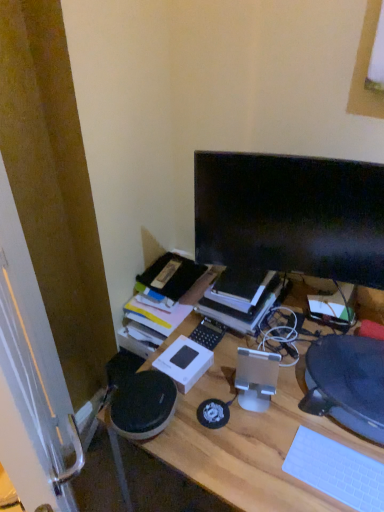
Question: Is white matte keyboard at lower right outside black textured computer chair at right?

Choices:
 (A) no
 (B) yes

Answer: (B)

Question: Does white matte keyboard at lower right lie behind black textured computer chair at right?

Choices:
 (A) no
 (B) yes

Answer: (A)

Question: From a real-world perspective, is white matte keyboard at lower right located higher than black textured computer chair at right?

Choices:
 (A) no
 (B) yes

Answer: (A)

Question: Considering the relative sizes of white matte keyboard at lower right and black textured computer chair at right in the image provided, is white matte keyboard at lower right shorter than black textured computer chair at right?

Choices:
 (A) yes
 (B) no

Answer: (A)

Question: From the image's perspective, is white matte keyboard at lower right beneath black textured computer chair at right?

Choices:
 (A) yes
 (B) no

Answer: (A)

Question: Is wooden desk at center to the left or to the right of white matte keyboard at lower right in the image?

Choices:
 (A) right
 (B) left

Answer: (B)

Question: From the image's perspective, is wooden desk at center above or below white matte keyboard at lower right?

Choices:
 (A) below
 (B) above

Answer: (A)

Question: Considering their positions, is wooden desk at center located in front of or behind white matte keyboard at lower right?

Choices:
 (A) behind
 (B) front

Answer: (B)

Question: Considering the positions of wooden desk at center and white matte keyboard at lower right in the image, is wooden desk at center bigger or smaller than white matte keyboard at lower right?

Choices:
 (A) small
 (B) big

Answer: (B)

Question: Considering the positions of hardcover book at center and black glossy monitor at upper right in the image, is hardcover book at center taller or shorter than black glossy monitor at upper right?

Choices:
 (A) short
 (B) tall

Answer: (A)

Question: Visually, is hardcover book at center positioned to the left or to the right of black glossy monitor at upper right?

Choices:
 (A) left
 (B) right

Answer: (A)

Question: From a real-world perspective, relative to black glossy monitor at upper right, is hardcover book at center vertically above or below?

Choices:
 (A) above
 (B) below

Answer: (B)

Question: From the image's perspective, is hardcover book at center located above or below black glossy monitor at upper right?

Choices:
 (A) above
 (B) below

Answer: (B)

Question: Considering the positions of point (319, 358) and point (243, 331), is point (319, 358) closer or farther from the camera than point (243, 331)?

Choices:
 (A) closer
 (B) farther

Answer: (A)

Question: From a real-world perspective, relative to hardcover book at center, is black textured computer chair at right vertically above or below?

Choices:
 (A) below
 (B) above

Answer: (A)